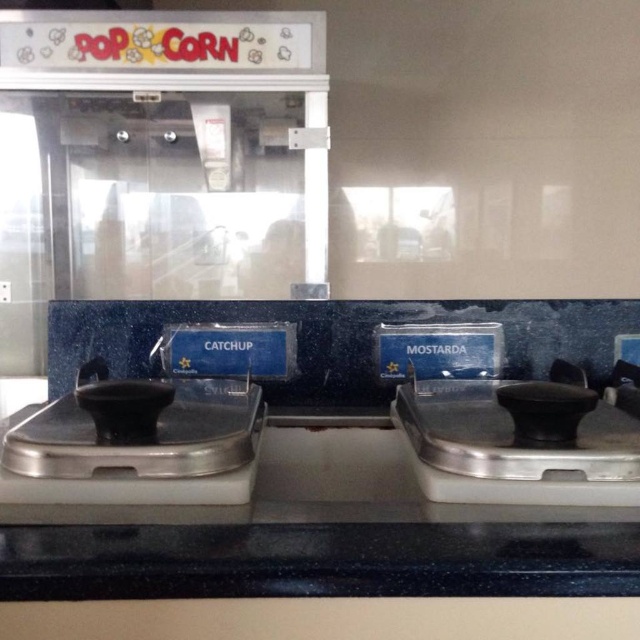
Question: Which point is farther from the camera taking this photo?

Choices:
 (A) (579, 384)
 (B) (227, 632)

Answer: (A)

Question: Which object appears closest to the camera in this image?

Choices:
 (A) black rubber condiment dispenser at right
 (B) satin silver dispenser at left

Answer: (A)

Question: Is black plastic tray at center positioned in front of satin silver dispenser at left?

Choices:
 (A) yes
 (B) no

Answer: (A)

Question: Does black plastic tray at center have a greater width compared to satin silver dispenser at left?

Choices:
 (A) no
 (B) yes

Answer: (B)

Question: Can you confirm if satin silver dispenser at left is positioned to the left of black rubber condiment dispenser at right?

Choices:
 (A) yes
 (B) no

Answer: (A)

Question: Which of the following is the closest to the observer?

Choices:
 (A) (380, 540)
 (B) (490, 474)
 (C) (230, 416)

Answer: (A)